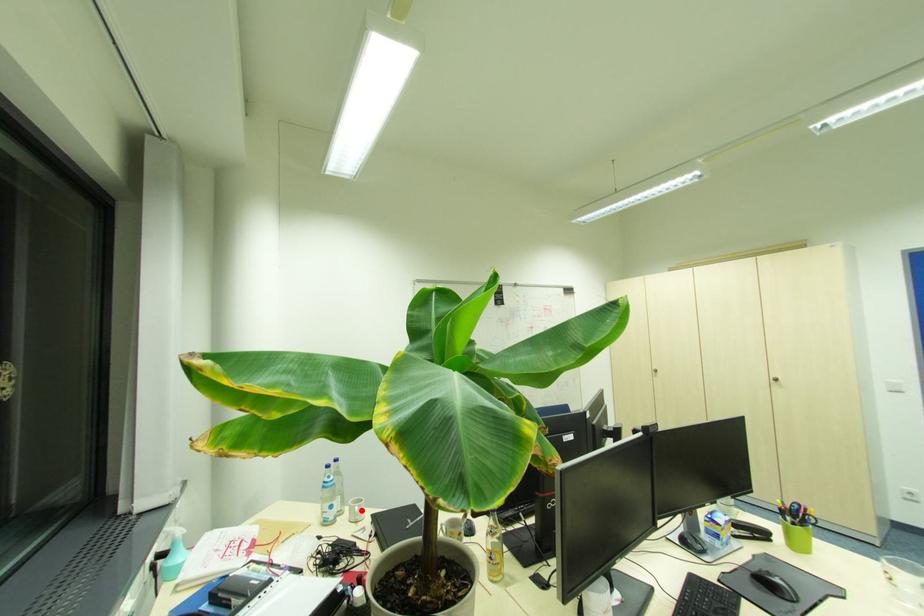
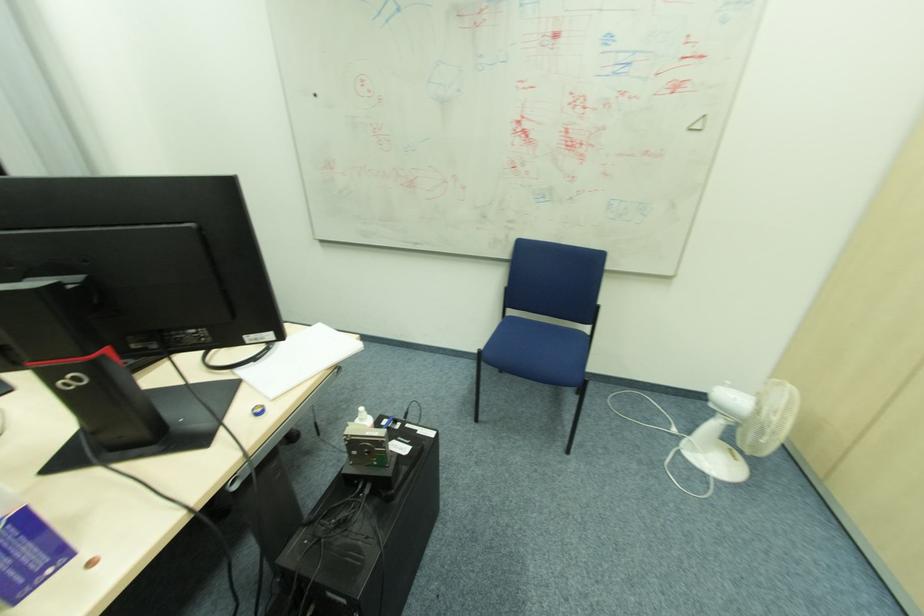
Question: I am providing you with two images of the same scene from different viewpoints. A red point is marked on the first image. At the location where the point appears in image 1, is it still visible in image 2?

Choices:
 (A) Yes
 (B) No

Answer: (B)